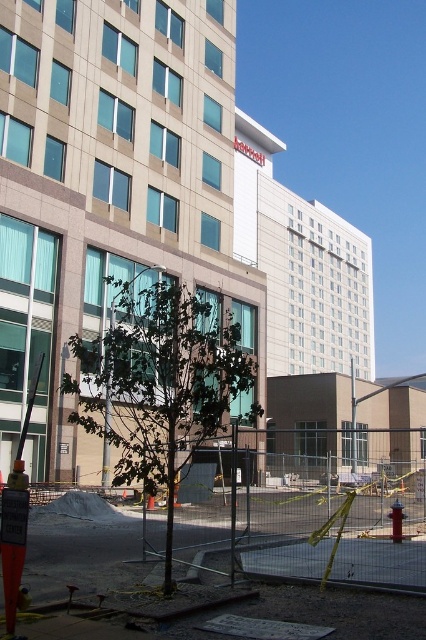
Question: Considering the real-world distances, which object is closest to the beige glass hotel at center?

Choices:
 (A) green leafy tree at center
 (B) metal mesh fence at center

Answer: (A)

Question: Which object appears closest to the camera in this image?

Choices:
 (A) green leafy tree at center
 (B) beige glass hotel at center
 (C) white smooth hotel at upper center

Answer: (A)

Question: Can you confirm if beige glass hotel at center is smaller than white smooth hotel at upper center?

Choices:
 (A) yes
 (B) no

Answer: (A)

Question: Is beige glass hotel at center to the left of metal mesh fence at center from the viewer's perspective?

Choices:
 (A) yes
 (B) no

Answer: (A)

Question: Is the position of beige glass hotel at center more distant than that of white smooth hotel at upper center?

Choices:
 (A) yes
 (B) no

Answer: (B)

Question: Which point appears farthest from the camera in this image?

Choices:
 (A) (345, 250)
 (B) (160, 412)
 (C) (368, 522)
 (D) (146, 88)

Answer: (A)